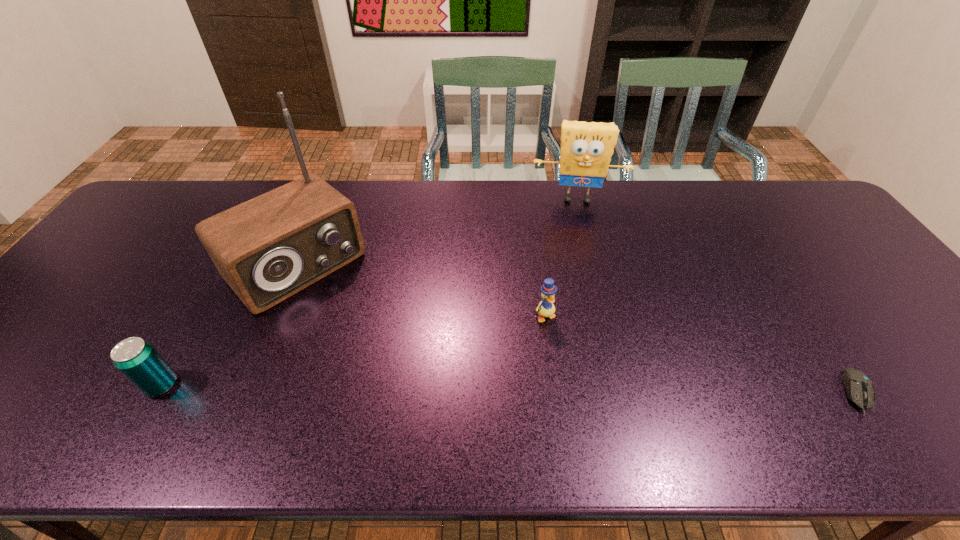
At what (x,y) coordinates should I click in order to perform the action: click on vacant space that satisfies the following two spatial constraints: 1. on the front side of the beer can; 2. on the left side of the shortest object. Please return your answer as a coordinate pair (x, y). Looking at the image, I should click on (157, 393).